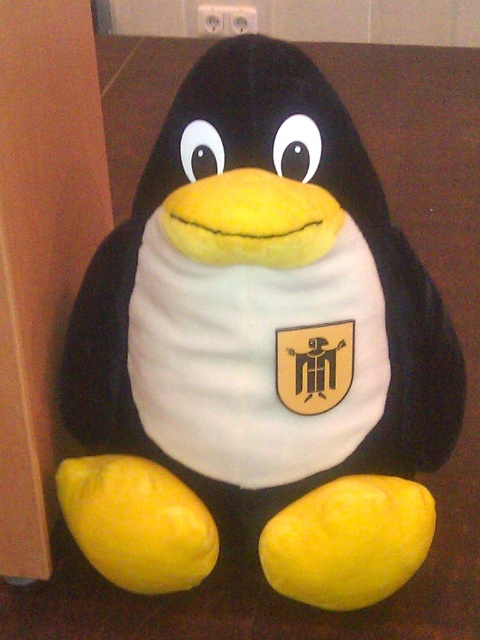
Measure the distance from yellow matte lemon at lower center to yellow matte lemon at lower left.

→ 15.18 centimeters

Is yellow matte lemon at lower center to the right of yellow matte lemon at lower left from the viewer's perspective?

Indeed, yellow matte lemon at lower center is positioned on the right side of yellow matte lemon at lower left.

Between point (425, 525) and point (183, 525), which one is positioned in front?

Point (183, 525) is in front.

Identify the location of yellow matte lemon at lower center. Image resolution: width=480 pixels, height=640 pixels. (348, 541).